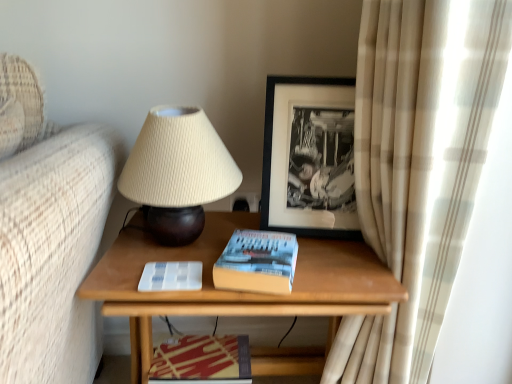
I want to click on unoccupied area in front of black matte picture frame at upper center, so click(x=340, y=254).